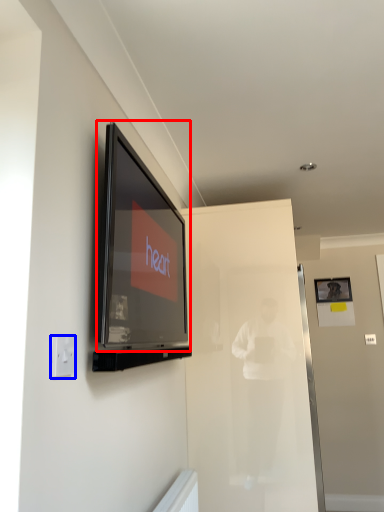
Question: Which point is further to the camera, television (highlighted by a red box) or electric outlet (highlighted by a blue box)?

Choices:
 (A) television
 (B) electric outlet

Answer: (A)